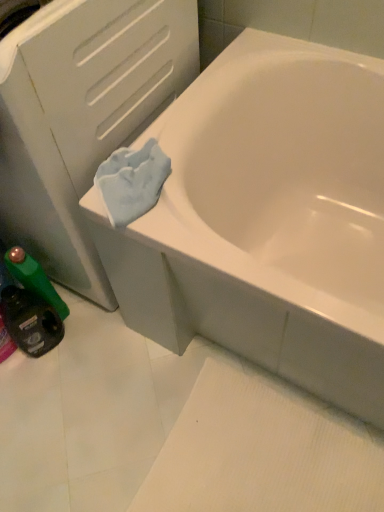
Question: Considering the relative sizes of white matte file cabinet at upper left and green plastic mouthwash at lower left, which appears as the second mouthwash when viewed from the top, in the image provided, is white matte file cabinet at upper left thinner than green plastic mouthwash at lower left, which appears as the second mouthwash when viewed from the top,?

Choices:
 (A) no
 (B) yes

Answer: (A)

Question: From the image's perspective, is white matte file cabinet at upper left located beneath green plastic mouthwash at lower left, which appears as the second mouthwash when viewed from the top?

Choices:
 (A) yes
 (B) no

Answer: (B)

Question: From the image's perspective, is white matte file cabinet at upper left over green plastic mouthwash at lower left, the first mouthwash positioned from the bottom?

Choices:
 (A) yes
 (B) no

Answer: (A)

Question: Could you tell me if white matte file cabinet at upper left is turned towards green plastic mouthwash at lower left, the first mouthwash positioned from the bottom?

Choices:
 (A) yes
 (B) no

Answer: (A)

Question: Can you confirm if white matte file cabinet at upper left is smaller than green plastic mouthwash at lower left, the first mouthwash positioned from the bottom?

Choices:
 (A) no
 (B) yes

Answer: (A)

Question: Is white matte file cabinet at upper left positioned behind green plastic mouthwash at lower left, the first mouthwash positioned from the bottom?

Choices:
 (A) no
 (B) yes

Answer: (A)

Question: From the image's perspective, is white glossy bathtub at upper right beneath green plastic bottle at lower left, the 1th mouthwash in the top-to-bottom sequence?

Choices:
 (A) no
 (B) yes

Answer: (A)

Question: Is white glossy bathtub at upper right taller than green plastic bottle at lower left, which is counted as the 2th mouthwash, starting from the bottom?

Choices:
 (A) no
 (B) yes

Answer: (B)

Question: Is white glossy bathtub at upper right not inside green plastic bottle at lower left, which is counted as the 2th mouthwash, starting from the bottom?

Choices:
 (A) no
 (B) yes

Answer: (B)

Question: Is white glossy bathtub at upper right wider than green plastic bottle at lower left, the 1th mouthwash in the top-to-bottom sequence?

Choices:
 (A) no
 (B) yes

Answer: (B)

Question: Is the depth of white glossy bathtub at upper right less than that of green plastic bottle at lower left, which is counted as the 2th mouthwash, starting from the bottom?

Choices:
 (A) yes
 (B) no

Answer: (A)

Question: Is green plastic bottle at lower left, the 1th mouthwash in the top-to-bottom sequence, completely or partially inside white glossy bathtub at upper right?

Choices:
 (A) yes
 (B) no

Answer: (B)

Question: Is green plastic bottle at lower left, the 1th mouthwash in the top-to-bottom sequence, completely or partially inside green plastic mouthwash at lower left, the first mouthwash positioned from the bottom?

Choices:
 (A) no
 (B) yes

Answer: (A)